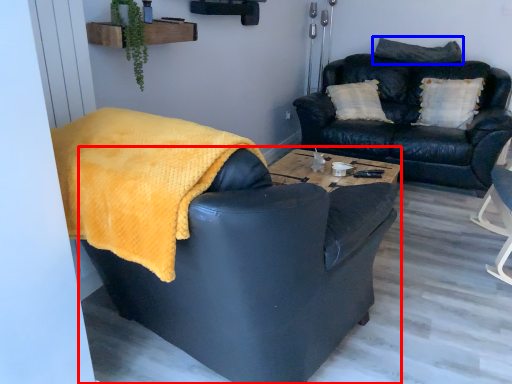
Question: Which of the following is the farthest to the observer, chair (highlighted by a red box) or pillow (highlighted by a blue box)?

Choices:
 (A) chair
 (B) pillow

Answer: (B)